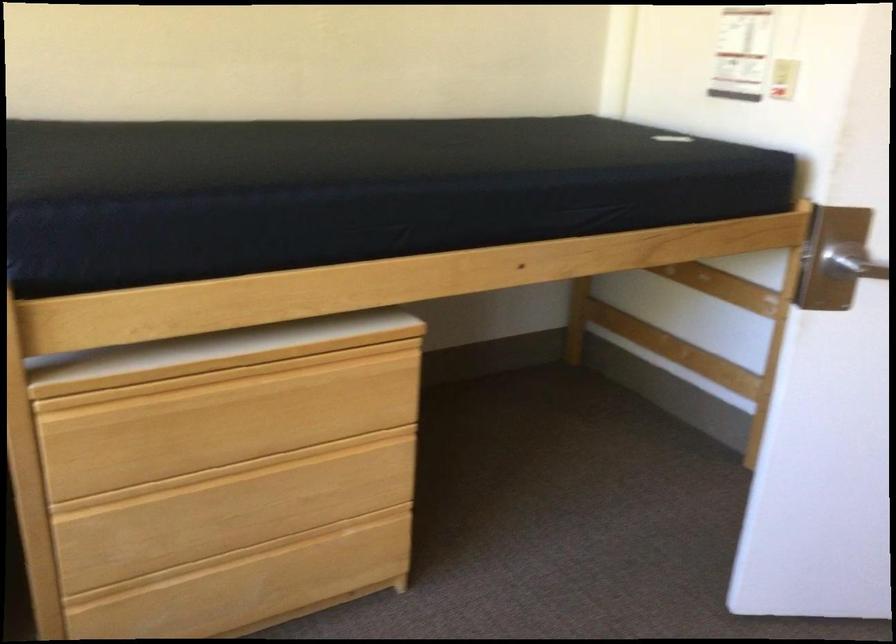
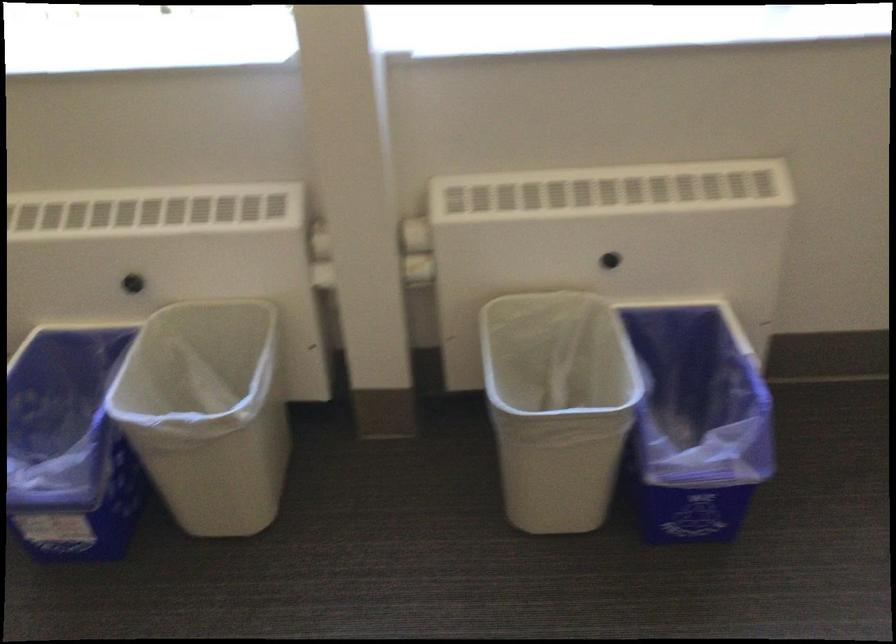
First-person continuous shooting, in which direction is the camera rotating?

The camera rotated toward left-down.